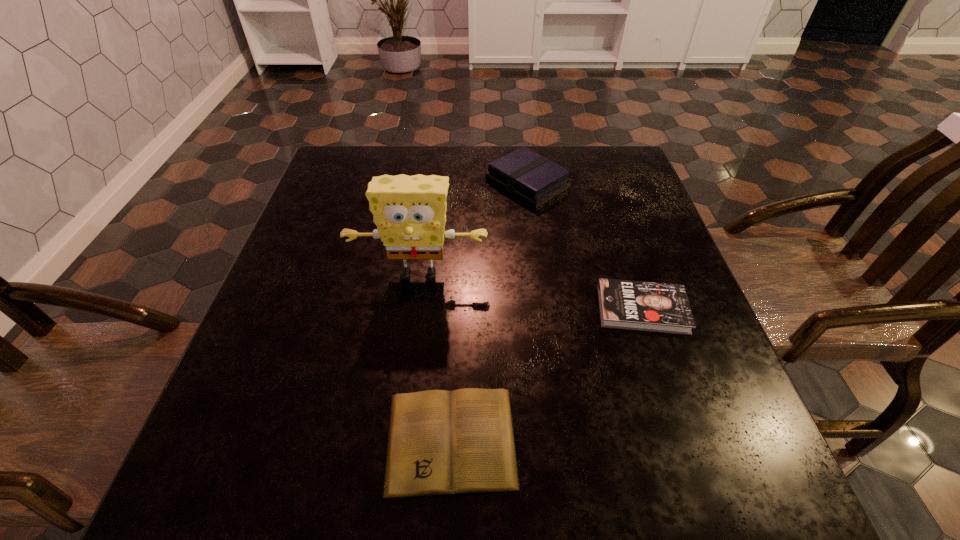
Find the location of a particular element. The width and height of the screenshot is (960, 540). free space that satisfies the following two spatial constraints: 1. on the face of the sponge; 2. on the left side of the second tallest book is located at coordinates (414, 309).

This screenshot has height=540, width=960. Identify the location of vacant space that satisfies the following two spatial constraints: 1. on the face of the shortest object; 2. on the left side of the sponge. (396, 440).

I want to click on vacant region that satisfies the following two spatial constraints: 1. on the face of the shortest book; 2. on the right side of the sponge, so click(x=396, y=440).